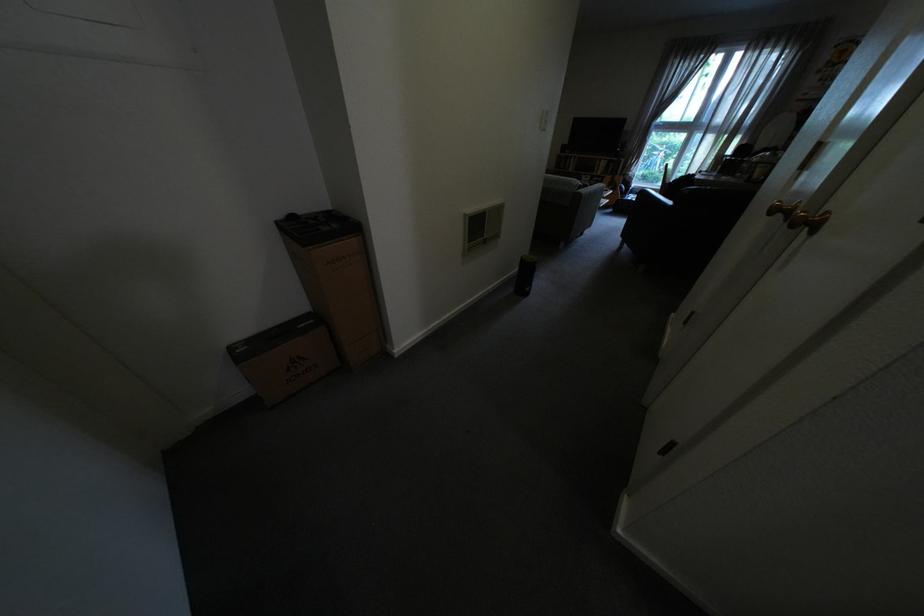
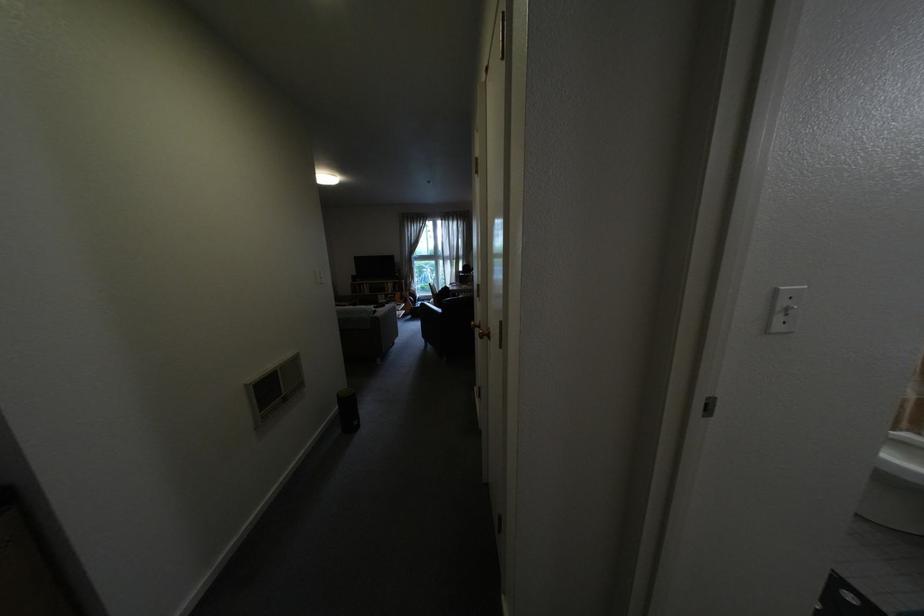
Question: The first image is from the beginning of the video and the second image is from the end. How did the camera likely rotate when shooting the video?

Choices:
 (A) Left
 (B) Right
 (C) Up
 (D) Down

Answer: (B)